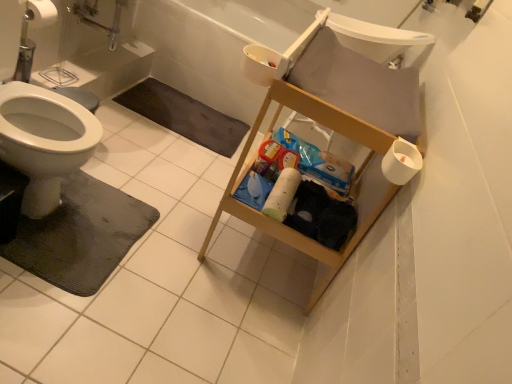
At what (x,y) coordinates should I click in order to perform the action: click on free space below black rubber bath mat at lower left, placed as the first bath mat when sorted from top to bottom (from a real-world perspective). Please return your answer as a coordinate pair (x, y). Looking at the image, I should click on (164, 105).